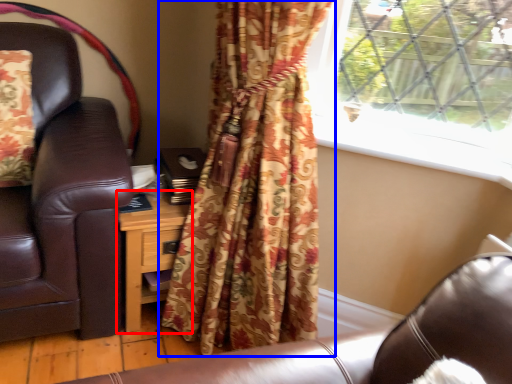
Question: Which point is further to the camera, nightstand (highlighted by a red box) or curtain (highlighted by a blue box)?

Choices:
 (A) nightstand
 (B) curtain

Answer: (A)